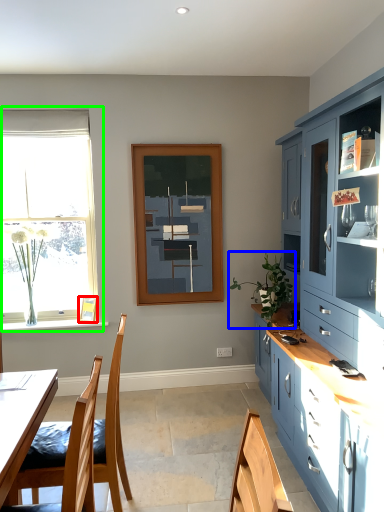
Question: Which is nearer to the picture frame (highlighted by a red box)? houseplant (highlighted by a blue box) or window (highlighted by a green box).

Choices:
 (A) houseplant
 (B) window

Answer: (B)